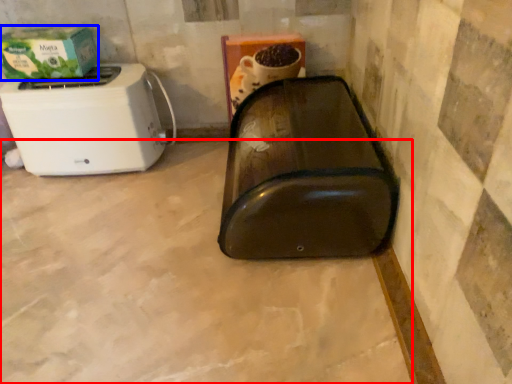
Question: Which object is further to the camera taking this photo, concrete (highlighted by a red box) or box (highlighted by a blue box)?

Choices:
 (A) concrete
 (B) box

Answer: (B)